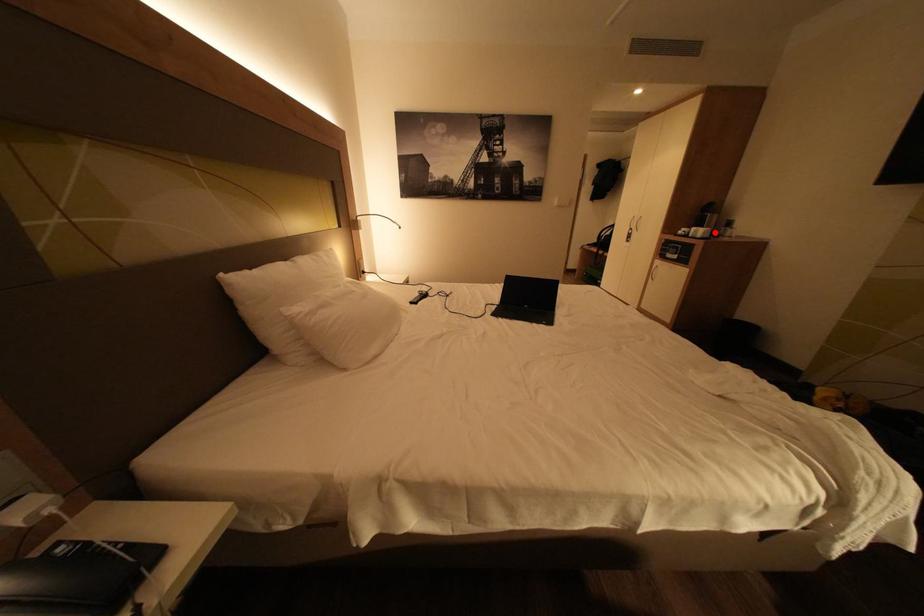
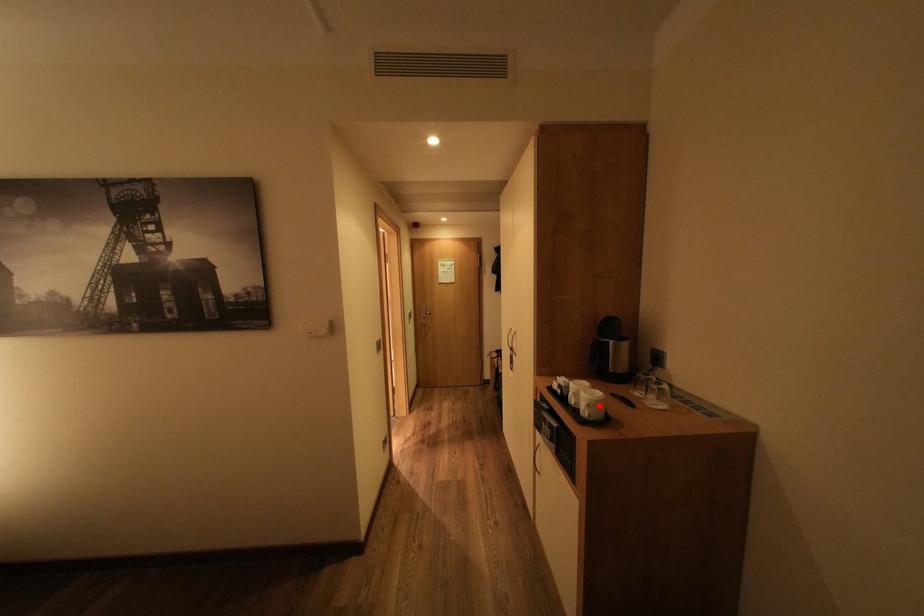
I am providing you with two images of the same scene from different viewpoints. A red point is marked on the first image and another point is marked on the second image. Is the red point in image1 aligned with the point shown in image2?

Yes